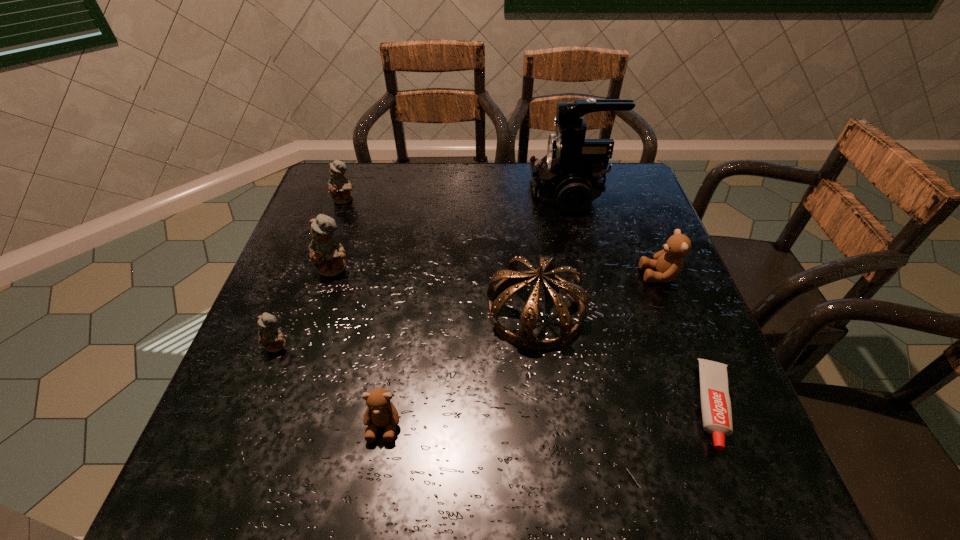
At what (x,y) coordinates should I click in order to perform the action: click on toothpaste at the right edge. Please return your answer as a coordinate pair (x, y). Looking at the image, I should click on (716, 409).

Locate an element on the screen. Image resolution: width=960 pixels, height=540 pixels. object situated at the far left corner is located at coordinates (339, 188).

You are a GUI agent. You are given a task and a screenshot of the screen. Output one action in this format:
    pyautogui.click(x=<x>, y=<y>)
    Task: Click on the object that is at the far right corner
    This screenshot has width=960, height=540.
    Given the screenshot: What is the action you would take?
    pyautogui.click(x=571, y=175)

Locate an element on the screen. The image size is (960, 540). object that is at the near right corner is located at coordinates (716, 409).

Where is `vacant space at the far edge of the desktop`? This screenshot has width=960, height=540. vacant space at the far edge of the desktop is located at coordinates (463, 191).

Where is `free location at the near edge of the desktop`? This screenshot has width=960, height=540. free location at the near edge of the desktop is located at coordinates (598, 478).

Identify the location of free space at the left edge of the desktop. This screenshot has height=540, width=960. (341, 236).

Image resolution: width=960 pixels, height=540 pixels. Identify the location of free space at the far left corner of the desktop. (358, 210).

Locate an element on the screen. This screenshot has height=540, width=960. vacant space at the far right corner of the desktop is located at coordinates (616, 177).

This screenshot has height=540, width=960. I want to click on vacant space at the near right corner of the desktop, so click(x=747, y=494).